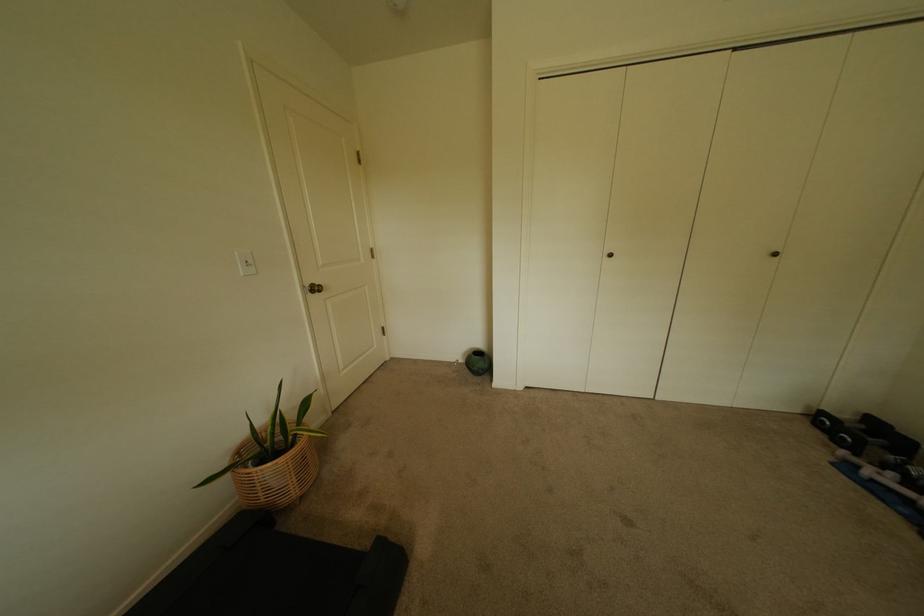
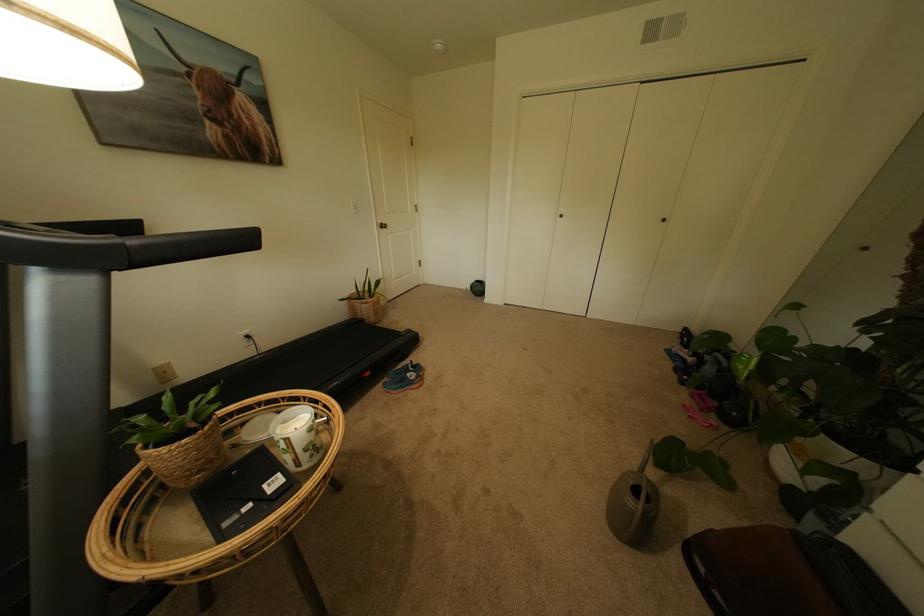
In the second image, find the point that corresponds to (463,362) in the first image.

(473, 289)